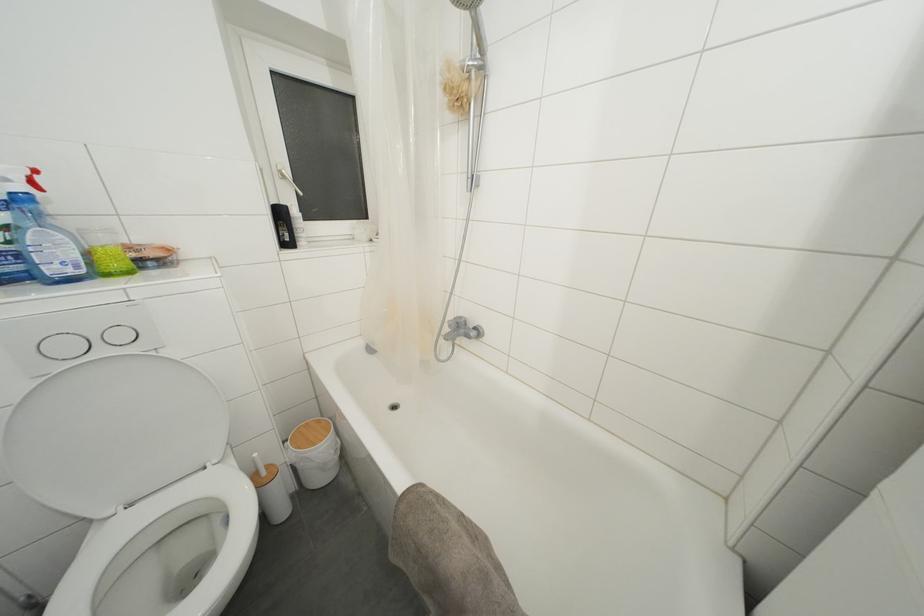
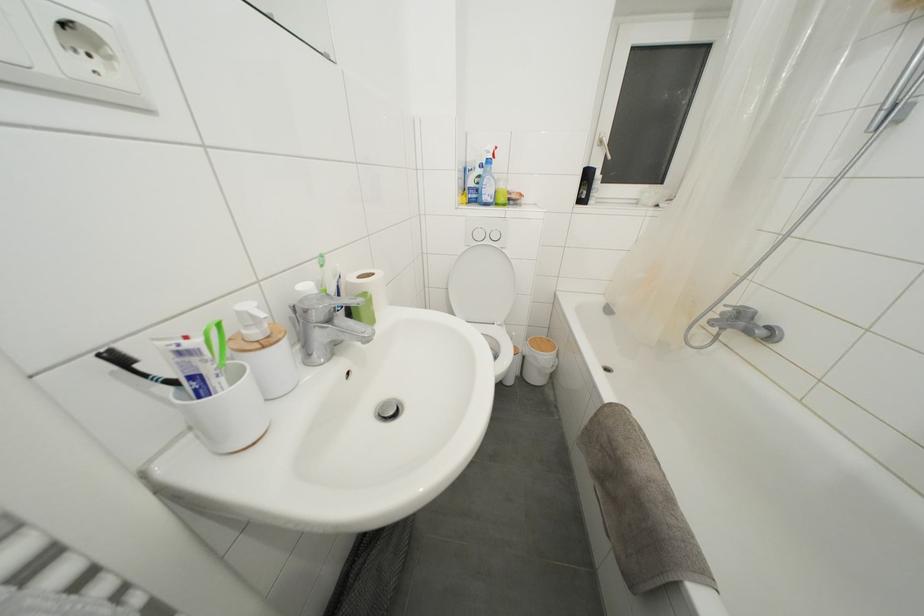
Question: The camera is either moving clockwise (left) or counter-clockwise (right) around the object. The first image is from the beginning of the video and the second image is from the end. Is the camera moving left or right when shooting the video?

Choices:
 (A) Left
 (B) Right

Answer: (B)